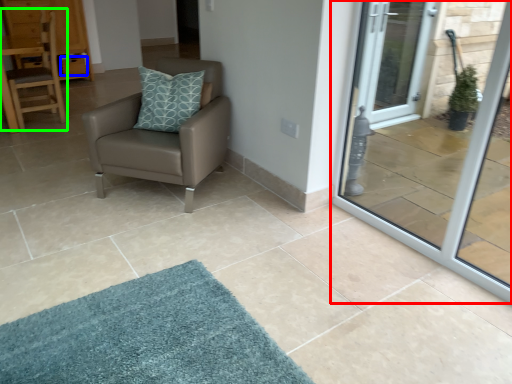
Question: Based on their relative distances, which object is nearer to door (highlighted by a red box)? Choose from drawer (highlighted by a blue box) and chair (highlighted by a green box).

Choices:
 (A) drawer
 (B) chair

Answer: (B)